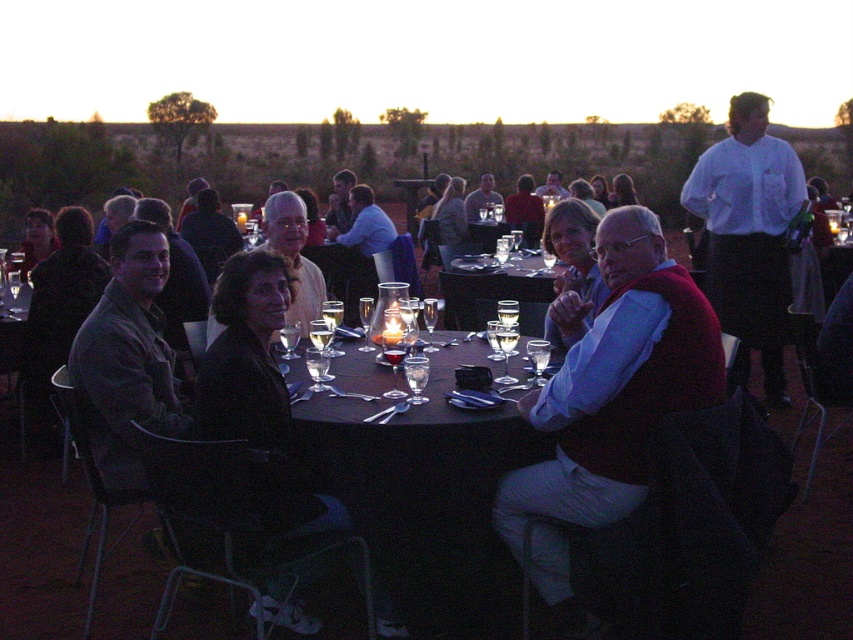
Does matte red vest at center appear on the left side of white shirt at upper right?

Correct, you'll find matte red vest at center to the left of white shirt at upper right.

Can you confirm if matte red vest at center is bigger than white shirt at upper right?

No, matte red vest at center is not bigger than white shirt at upper right.

The height and width of the screenshot is (640, 853). I want to click on matte red vest at center, so click(608, 401).